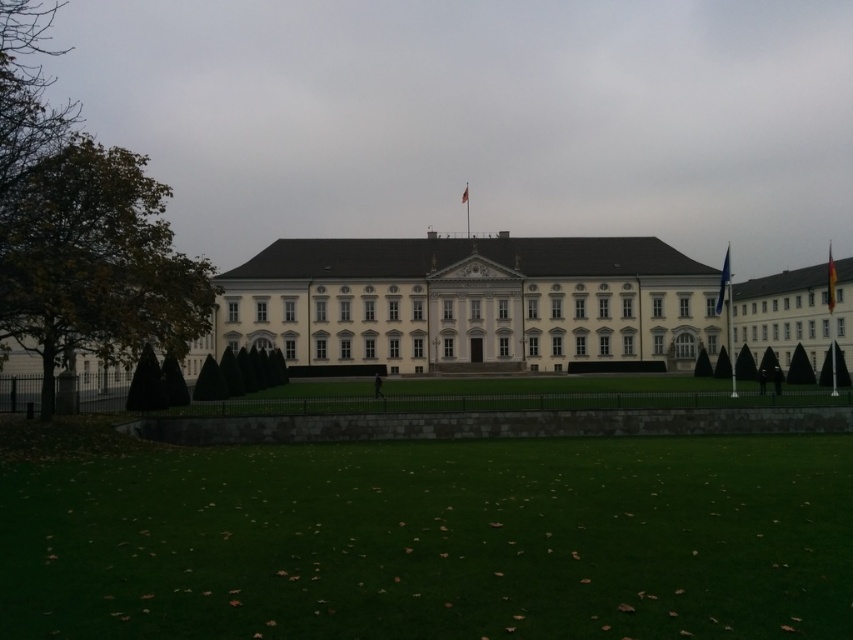
Is green grass at lower center smaller than green leafy tree at left?

Indeed, green grass at lower center has a smaller size compared to green leafy tree at left.

The image size is (853, 640). What do you see at coordinates (432, 541) in the screenshot?
I see `green grass at lower center` at bounding box center [432, 541].

The height and width of the screenshot is (640, 853). What are the coordinates of `green grass at lower center` in the screenshot? It's located at (432, 541).